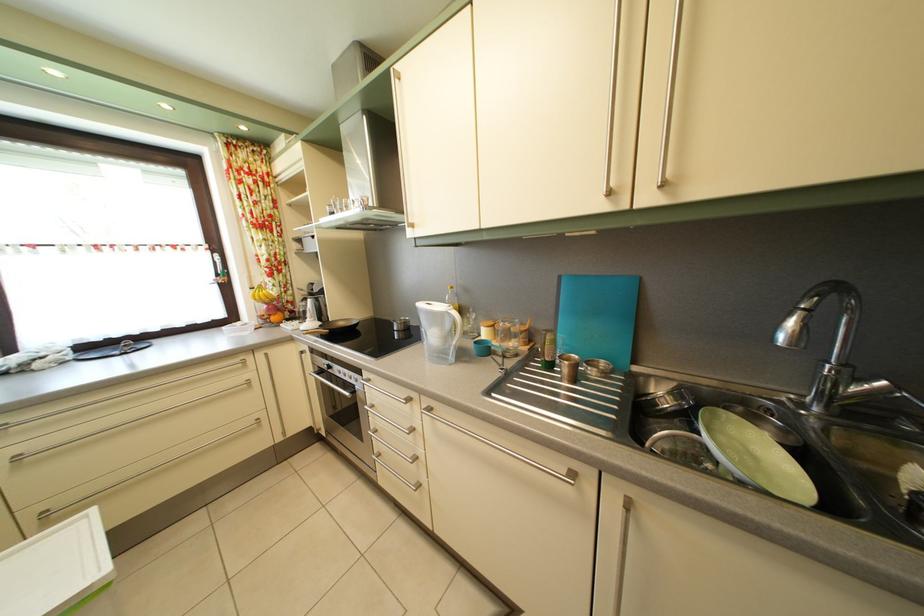
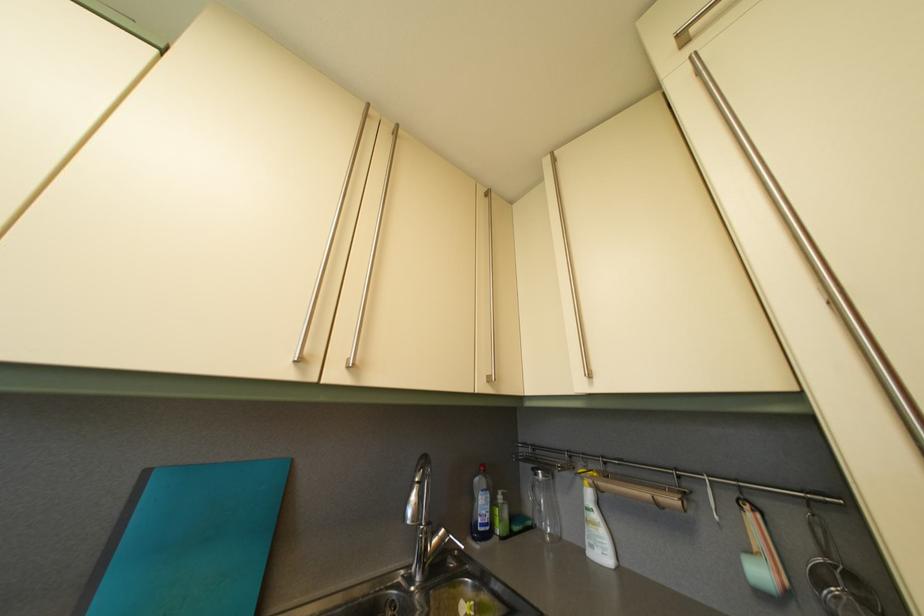
The first image is from the beginning of the video and the second image is from the end. How did the camera likely rotate when shooting the video?

The rotation direction of the camera is right-up.